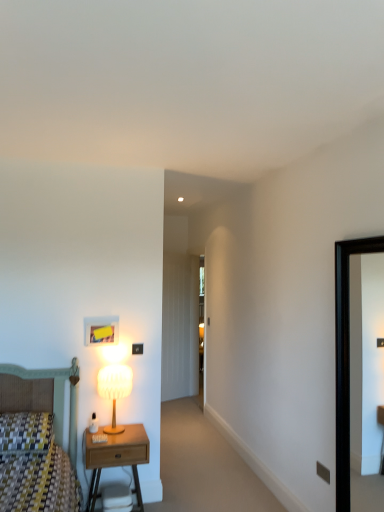
Locate an element on the screen. Image resolution: width=384 pixels, height=512 pixels. empty space that is ontop of wooden nightstand at lower left (from a real-world perspective) is located at coordinates (120, 433).